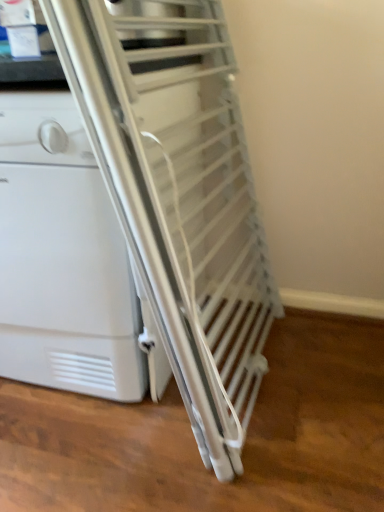
Question: Should I look upward or downward to see white matte dishwasher at left?

Choices:
 (A) up
 (B) down

Answer: (A)